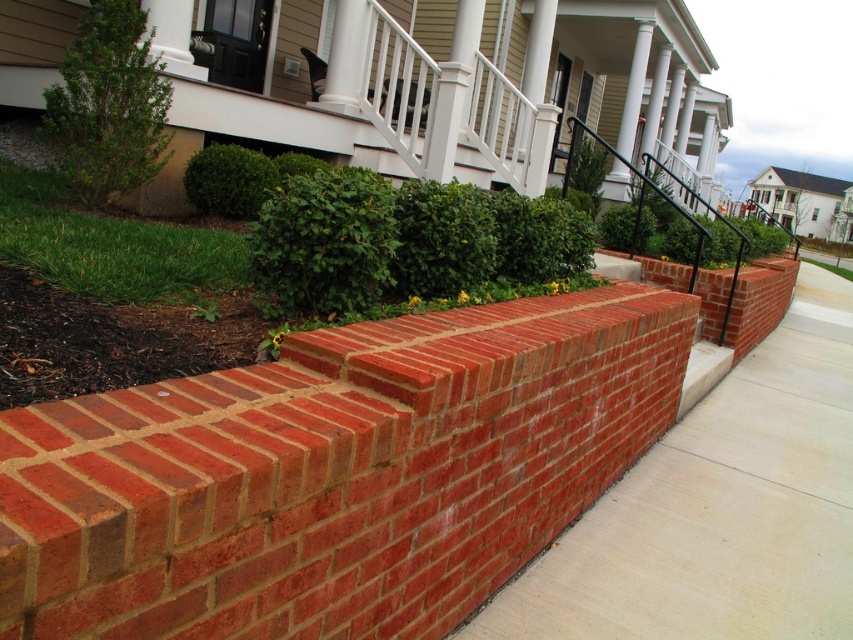
What do you see at coordinates (334, 474) in the screenshot? This screenshot has width=853, height=640. I see `red brick wall at center` at bounding box center [334, 474].

Does red brick wall at center come behind green leafy bush at upper left?

No.

What do you see at coordinates (334, 474) in the screenshot? I see `red brick wall at center` at bounding box center [334, 474].

The height and width of the screenshot is (640, 853). Find the location of `red brick wall at center`. red brick wall at center is located at coordinates (334, 474).

Does red brick pavement at center appear over green leafy bush at upper left?

No, red brick pavement at center is not above green leafy bush at upper left.

Between red brick pavement at center and green leafy bush at upper left, which one is positioned lower?

red brick pavement at center is below.

Identify the location of red brick pavement at center. (718, 508).

Image resolution: width=853 pixels, height=640 pixels. What are the coordinates of `red brick pavement at center` in the screenshot? It's located at (718, 508).

Does point (384, 237) come closer to viewer compared to point (142, 19)?

Yes, it is in front of point (142, 19).

How much distance is there between green leafy hedge at center and green leafy bush at upper left?

green leafy hedge at center and green leafy bush at upper left are 2.13 meters apart.

Measure the distance between point (279,300) and camera.

Point (279,300) and camera are 8.62 feet apart from each other.

You are a GUI agent. You are given a task and a screenshot of the screen. Output one action in this format:
    pyautogui.click(x=<x>, y=<y>)
    Task: Click on the green leafy hedge at center
    This screenshot has width=853, height=640.
    Given the screenshot: What is the action you would take?
    pyautogui.click(x=404, y=241)